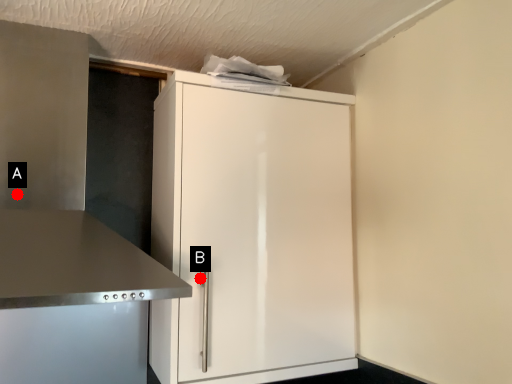
Question: Two points are circled on the image, labeled by A and B beside each circle. Among these points, which one is nearest to the camera?

Choices:
 (A) A is closer
 (B) B is closer

Answer: (A)